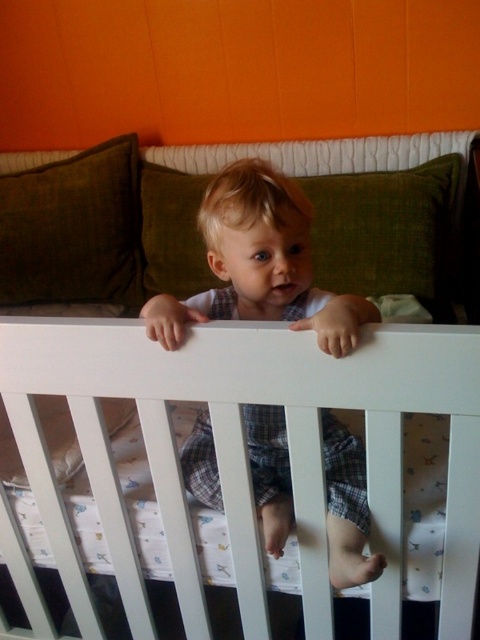
You are a parent trying to place a new stuffed animal between the green fabric pillow at upper center and the green fabric pillow at upper left. Which pillow should you place the stuffed animal closer to if you want it near the shorter one?

You should place the stuffed animal closer to the green fabric pillow at upper center because it is shorter than the green fabric pillow at upper left.

You are a parent trying to place a new stuffed animal between the green fabric pillow at upper center and the green fabric pillow at upper left. Based on their positions, which pillow should you place the stuffed animal closer to in order to have it near the front of the crib?

The green fabric pillow at upper center is in front of the green fabric pillow at upper left, so placing the stuffed animal closer to the green fabric pillow at upper center will position it near the front of the crib.

You are a photographer taking a picture of the child in the crib. You need to focus on two specific points in the image, point A at point (278, 259) and point B at point (57, 198). Which point should you focus on first to ensure the child is in focus?

Point A at point (278, 259) is closer to the viewer than point B at point (57, 198). Therefore, focusing on point A first will ensure the child is in focus since it is nearer to the camera.